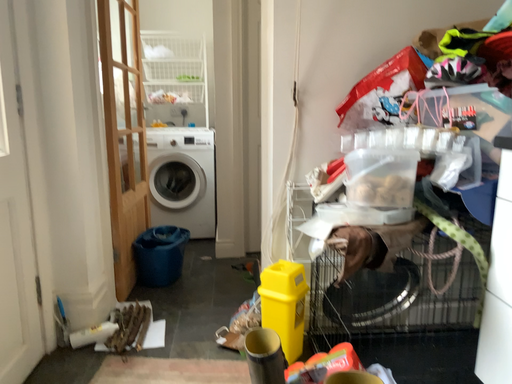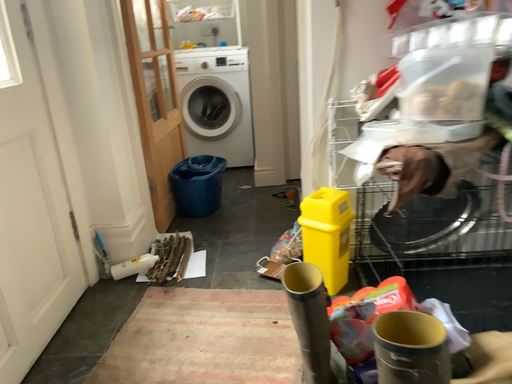
Question: Which way did the camera rotate in the video?

Choices:
 (A) rotated downward
 (B) rotated upward

Answer: (A)